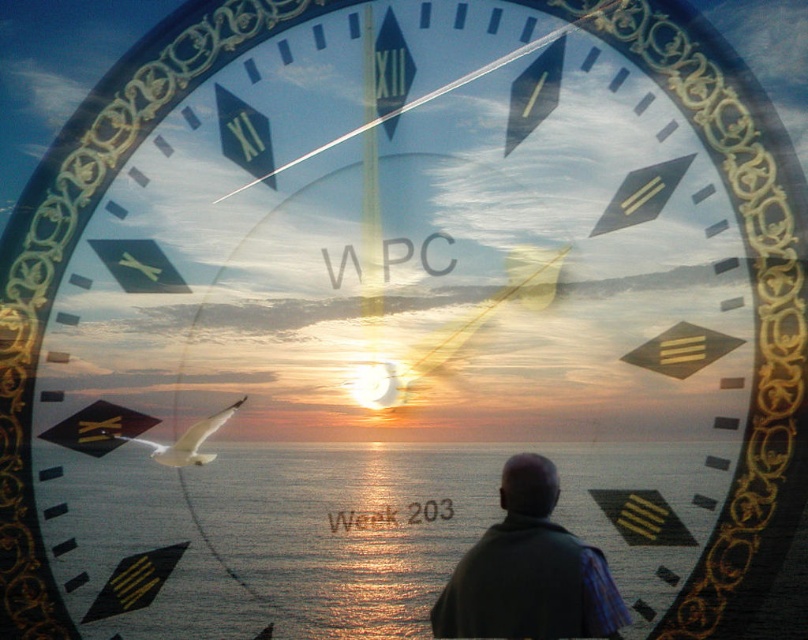
You are an observer looking at the clock in the image. You see a dark gray fabric at center and a white feathered bird at center. Which object is positioned to the right of the other?

The dark gray fabric at center is to the right of the white feathered bird at center.

You are an observer looking at the image. There are two points marked in the scene. The first point is at coordinates point (x=574, y=566) and the second is at point (x=112, y=435). Based on the clock and sunset background, which point is closer to you?

Point (x=574, y=566) is in front of point (x=112, y=435), so the first point is closer to you.

You are an artist trying to paint the scene. You want to ensure the glistening ocean water at center and the white feathered bird at center are positioned correctly. Based on the image, which object should appear in front of the other?

The glistening ocean water at center is closer to the viewer than the white feathered bird at center, so the glistening ocean water at center should be painted in front of the white feathered bird at center.